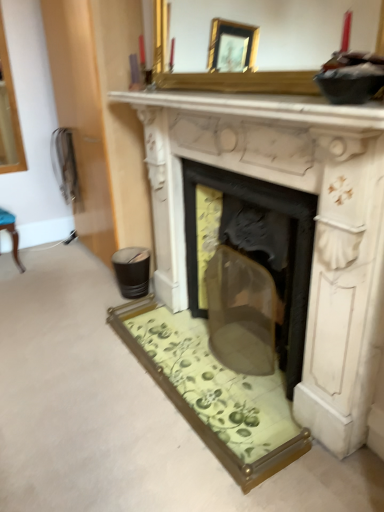
Question: In terms of height, does white marble fireplace at center look taller or shorter compared to gold-framed mirror at upper center?

Choices:
 (A) tall
 (B) short

Answer: (A)

Question: Looking at their shapes, would you say white marble fireplace at center is wider or thinner than gold-framed mirror at upper center?

Choices:
 (A) wide
 (B) thin

Answer: (A)

Question: Estimate the real-world distances between objects in this image. Which object is closer to the white marble fireplace at upper center?

Choices:
 (A) gold-framed mirror at upper center
 (B) white marble fireplace at center

Answer: (B)

Question: Estimate the real-world distances between objects in this image. Which object is farther from the white marble fireplace at center?

Choices:
 (A) gold-framed mirror at upper center
 (B) white marble fireplace at upper center

Answer: (A)